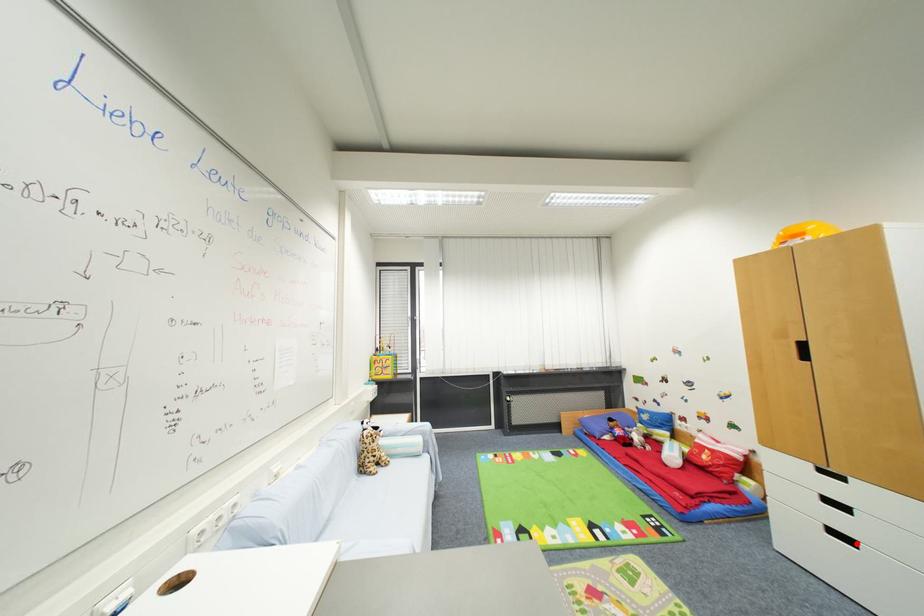
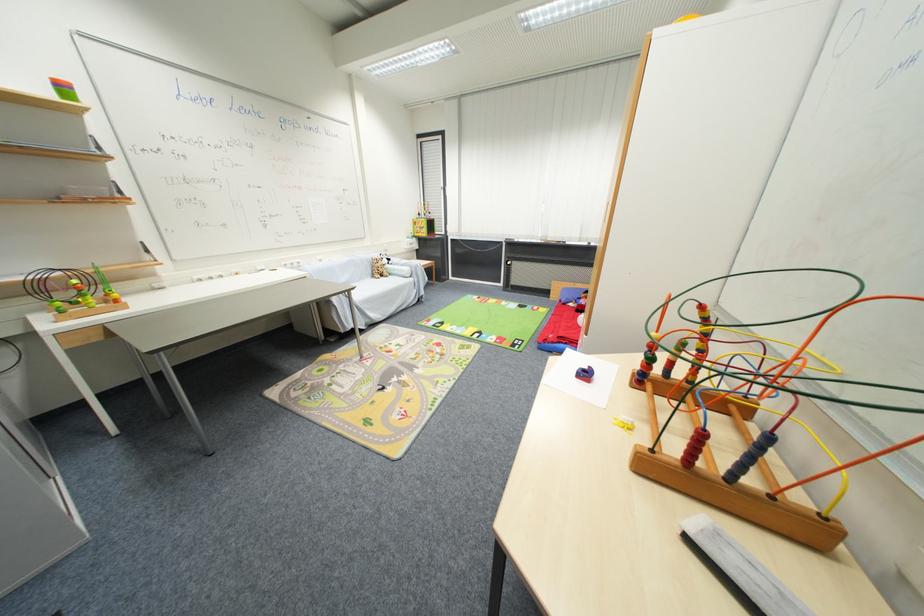
Question: I am providing you with two images of the same scene from different viewpoints. A red point is marked on the first image. At the location where the point appears in image 1, is it still visible in image 2?

Choices:
 (A) Yes
 (B) No

Answer: (B)